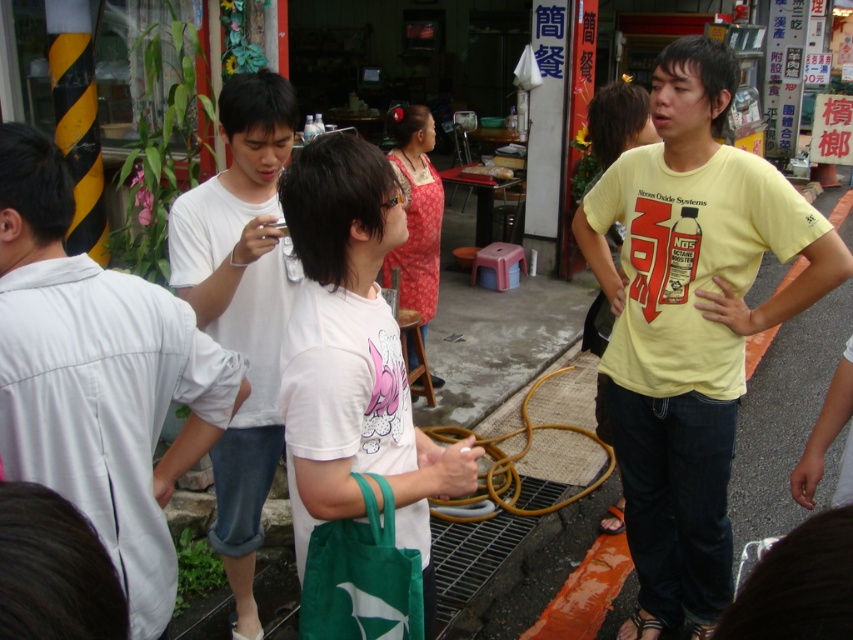
Question: Which of the following is the farthest from the observer?

Choices:
 (A) (735, 307)
 (B) (15, 410)
 (C) (260, 195)
 (D) (360, 595)

Answer: (C)

Question: Which object is the farthest from the green fabric bag at lower center?

Choices:
 (A) white cotton t-shirt at center
 (B) white cotton shirt at left
 (C) yellow cotton t-shirt at right

Answer: (C)

Question: Does white cotton shirt at left appear under white cotton t-shirt at center?

Choices:
 (A) yes
 (B) no

Answer: (B)

Question: Does yellow cotton t-shirt at right lie behind white cotton shirt at left?

Choices:
 (A) no
 (B) yes

Answer: (B)

Question: Which object is the farthest from the white matte t-shirt at center?

Choices:
 (A) yellow cotton t-shirt at right
 (B) green fabric bag at lower center
 (C) white cotton t-shirt at center

Answer: (A)

Question: Does white cotton shirt at left have a larger size compared to white matte t-shirt at center?

Choices:
 (A) yes
 (B) no

Answer: (B)